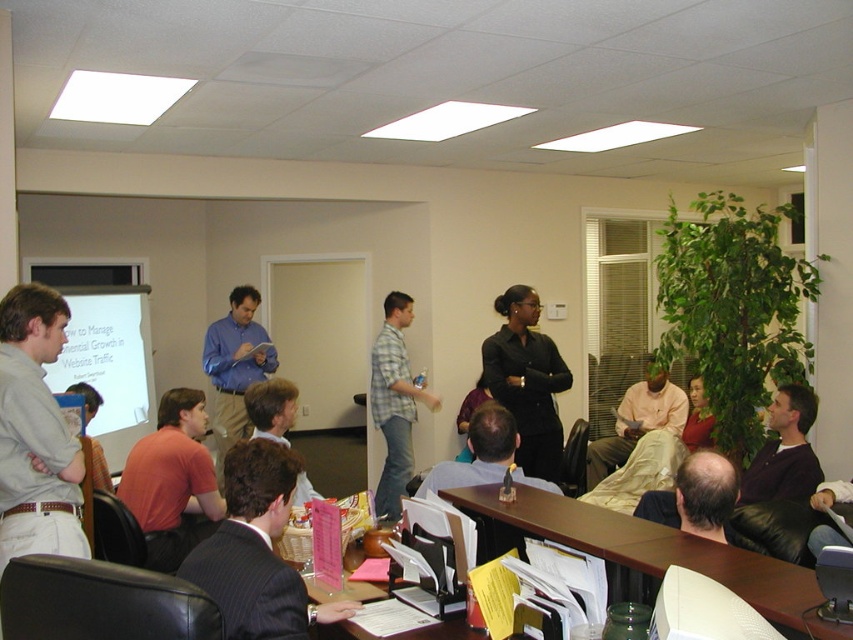
You are standing in the conference room and need to locate the dark gray suit at center. According to the coordinates provided, where would you find it?

The dark gray suit at center is located at coordinates point (256,552).

You are attending a meeting and notice two attendees wearing light gray shirt at left and matte orange shirt at lower left. Which one is positioned higher in the image?

The light gray shirt at left is positioned higher than the matte orange shirt at lower left in the image.